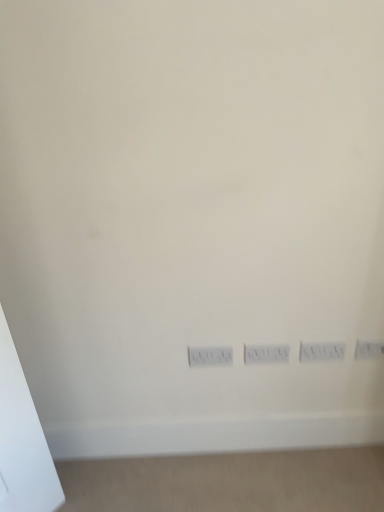
This screenshot has height=512, width=384. What do you see at coordinates (369, 349) in the screenshot? I see `white plastic electric outlet at lower right, positioned as the first electric outlet in right-to-left order` at bounding box center [369, 349].

Find the location of a particular element. Image resolution: width=384 pixels, height=512 pixels. white plastic power plugs and sockets at center is located at coordinates (210, 356).

Image resolution: width=384 pixels, height=512 pixels. Find the location of `white plastic electric outlet at center, the 2th electric outlet from the right`. white plastic electric outlet at center, the 2th electric outlet from the right is located at coordinates (321, 351).

This screenshot has width=384, height=512. What do you see at coordinates (321, 351) in the screenshot?
I see `white plastic electric outlet at center, the first electric outlet viewed from the left` at bounding box center [321, 351].

The width and height of the screenshot is (384, 512). I want to click on white plastic switch at center, so click(266, 354).

Between white plastic power plugs and sockets at center and white plastic electric outlet at center, the first electric outlet viewed from the left, which one appears on the right side from the viewer's perspective?

From the viewer's perspective, white plastic electric outlet at center, the first electric outlet viewed from the left, appears more on the right side.

Which of these two, white plastic power plugs and sockets at center or white plastic electric outlet at center, the first electric outlet viewed from the left, stands taller?

white plastic electric outlet at center, the first electric outlet viewed from the left, is taller.

Is white plastic power plugs and sockets at center positioned with its back to white plastic electric outlet at center, the first electric outlet viewed from the left?

white plastic power plugs and sockets at center is not turned away from white plastic electric outlet at center, the first electric outlet viewed from the left.

Is white plastic power plugs and sockets at center closer to the viewer compared to white plastic electric outlet at center, the 2th electric outlet from the right?

No, white plastic power plugs and sockets at center is further to the viewer.

Where is `electric outlet above the white plastic electric outlet at center, the first electric outlet viewed from the left (from the image's perspective)`? electric outlet above the white plastic electric outlet at center, the first electric outlet viewed from the left (from the image's perspective) is located at coordinates pos(369,349).

Is white plastic electric outlet at lower right, marked as the 2th electric outlet in a left-to-right arrangement, wider than white plastic electric outlet at center, the first electric outlet viewed from the left?

No.

Can white plastic electric outlet at center, the first electric outlet viewed from the left, be found inside white plastic electric outlet at lower right, marked as the 2th electric outlet in a left-to-right arrangement?

No, white plastic electric outlet at lower right, marked as the 2th electric outlet in a left-to-right arrangement, does not contain white plastic electric outlet at center, the first electric outlet viewed from the left.

Is white plastic electric outlet at lower right, marked as the 2th electric outlet in a left-to-right arrangement, positioned with its back to white plastic electric outlet at center, the 2th electric outlet from the right?

white plastic electric outlet at lower right, marked as the 2th electric outlet in a left-to-right arrangement, is not turned away from white plastic electric outlet at center, the 2th electric outlet from the right.

From the image's perspective, who appears lower, white plastic electric outlet at lower right, marked as the 2th electric outlet in a left-to-right arrangement, or white plastic switch at center?

white plastic switch at center.

Considering the sizes of white plastic electric outlet at lower right, marked as the 2th electric outlet in a left-to-right arrangement, and white plastic switch at center in the image, is white plastic electric outlet at lower right, marked as the 2th electric outlet in a left-to-right arrangement, bigger or smaller than white plastic switch at center?

white plastic electric outlet at lower right, marked as the 2th electric outlet in a left-to-right arrangement, is smaller than white plastic switch at center.

Is white plastic electric outlet at lower right, positioned as the first electric outlet in right-to-left order, taller or shorter than white plastic switch at center?

Clearly, white plastic electric outlet at lower right, positioned as the first electric outlet in right-to-left order, is shorter compared to white plastic switch at center.

Looking at this image, could you tell me if white plastic electric outlet at lower right, marked as the 2th electric outlet in a left-to-right arrangement, is turned towards white plastic switch at center?

No.

Is point (331, 354) less distant than point (383, 352)?

Yes, it is.

From a real-world perspective, which is physically above, white plastic electric outlet at center, the 2th electric outlet from the right, or white plastic electric outlet at lower right, marked as the 2th electric outlet in a left-to-right arrangement?

white plastic electric outlet at lower right, marked as the 2th electric outlet in a left-to-right arrangement, from a real-world perspective.

Does white plastic electric outlet at center, the first electric outlet viewed from the left, appear on the right side of white plastic electric outlet at lower right, marked as the 2th electric outlet in a left-to-right arrangement?

In fact, white plastic electric outlet at center, the first electric outlet viewed from the left, is to the left of white plastic electric outlet at lower right, marked as the 2th electric outlet in a left-to-right arrangement.

How different are the orientations of white plastic electric outlet at center, the first electric outlet viewed from the left, and white plastic electric outlet at lower right, marked as the 2th electric outlet in a left-to-right arrangement, in degrees?

0 degrees separate the facing orientations of white plastic electric outlet at center, the first electric outlet viewed from the left, and white plastic electric outlet at lower right, marked as the 2th electric outlet in a left-to-right arrangement.

Is white plastic electric outlet at lower right, marked as the 2th electric outlet in a left-to-right arrangement, spatially inside white plastic power plugs and sockets at center, or outside of it?

white plastic electric outlet at lower right, marked as the 2th electric outlet in a left-to-right arrangement, is located beyond the bounds of white plastic power plugs and sockets at center.

Is white plastic electric outlet at lower right, positioned as the first electric outlet in right-to-left order, wider or thinner than white plastic power plugs and sockets at center?

Clearly, white plastic electric outlet at lower right, positioned as the first electric outlet in right-to-left order, has more width compared to white plastic power plugs and sockets at center.

How many degrees apart are the facing directions of white plastic electric outlet at lower right, positioned as the first electric outlet in right-to-left order, and white plastic power plugs and sockets at center?

The angle between the facing direction of white plastic electric outlet at lower right, positioned as the first electric outlet in right-to-left order, and the facing direction of white plastic power plugs and sockets at center is 0.0477 degrees.

Does point (382, 348) lie behind point (209, 364)?

That is False.

Would you say white plastic switch at center is part of white plastic electric outlet at center, the 2th electric outlet from the right,'s contents?

No, white plastic switch at center is not surrounded by white plastic electric outlet at center, the 2th electric outlet from the right.

From a real-world perspective, is white plastic electric outlet at center, the first electric outlet viewed from the left, positioned above or below white plastic switch at center?

From a real-world perspective, white plastic electric outlet at center, the first electric outlet viewed from the left, is physically above white plastic switch at center.

Considering the sizes of objects white plastic electric outlet at center, the first electric outlet viewed from the left, and white plastic switch at center in the image provided, who is taller, white plastic electric outlet at center, the first electric outlet viewed from the left, or white plastic switch at center?

white plastic switch at center is taller.

Between white plastic electric outlet at center, the 2th electric outlet from the right, and white plastic switch at center, which one appears on the right side from the viewer's perspective?

Positioned to the right is white plastic electric outlet at center, the 2th electric outlet from the right.

From a real-world perspective, is white plastic switch at center beneath white plastic electric outlet at center, the first electric outlet viewed from the left?

Yes, from a real-world perspective, white plastic switch at center is beneath white plastic electric outlet at center, the first electric outlet viewed from the left.

Is white plastic switch at center oriented away from white plastic electric outlet at center, the 2th electric outlet from the right?

No, white plastic electric outlet at center, the 2th electric outlet from the right, is not at the back of white plastic switch at center.

Which electric outlet is the 1st one when counting from the right side of the white plastic switch at center? Please provide its 2D coordinates.

[(321, 351)]

Locate an element on the screen. The height and width of the screenshot is (512, 384). power plugs and sockets on the left side of white plastic electric outlet at center, the 2th electric outlet from the right is located at coordinates (210, 356).

This screenshot has height=512, width=384. What are the coordinates of `electric outlet located in front of the white plastic electric outlet at lower right, positioned as the first electric outlet in right-to-left order` in the screenshot? It's located at (321, 351).

When comparing their distances from white plastic power plugs and sockets at center, does white plastic switch at center or white plastic electric outlet at center, the first electric outlet viewed from the left, seem closer?

Among the two, white plastic switch at center is located nearer to white plastic power plugs and sockets at center.

Based on their spatial positions, is white plastic switch at center or white plastic power plugs and sockets at center closer to white plastic electric outlet at lower right, positioned as the first electric outlet in right-to-left order?

white plastic switch at center.

Which object lies nearer to the anchor point white plastic switch at center, white plastic electric outlet at center, the 2th electric outlet from the right, or white plastic electric outlet at lower right, positioned as the first electric outlet in right-to-left order?

white plastic electric outlet at center, the 2th electric outlet from the right, is closer to white plastic switch at center.

Looking at this image, estimate the real-world distances between objects in this image. Which object is closer to white plastic electric outlet at lower right, marked as the 2th electric outlet in a left-to-right arrangement, white plastic power plugs and sockets at center or white plastic switch at center?

Among the two, white plastic switch at center is located nearer to white plastic electric outlet at lower right, marked as the 2th electric outlet in a left-to-right arrangement.

Which object lies further to the anchor point white plastic electric outlet at lower right, positioned as the first electric outlet in right-to-left order, white plastic switch at center or white plastic electric outlet at center, the first electric outlet viewed from the left?

The object further to white plastic electric outlet at lower right, positioned as the first electric outlet in right-to-left order, is white plastic switch at center.

From the image, which object appears to be nearer to white plastic electric outlet at center, the first electric outlet viewed from the left, white plastic electric outlet at lower right, positioned as the first electric outlet in right-to-left order, or white plastic power plugs and sockets at center?

Among the two, white plastic electric outlet at lower right, positioned as the first electric outlet in right-to-left order, is located nearer to white plastic electric outlet at center, the first electric outlet viewed from the left.

When comparing their distances from white plastic switch at center, does white plastic power plugs and sockets at center or white plastic electric outlet at center, the first electric outlet viewed from the left, seem closer?

white plastic electric outlet at center, the first electric outlet viewed from the left.

From the image, which object appears to be farther from white plastic electric outlet at center, the first electric outlet viewed from the left, white plastic switch at center or white plastic electric outlet at lower right, positioned as the first electric outlet in right-to-left order?

white plastic switch at center is further to white plastic electric outlet at center, the first electric outlet viewed from the left.

Image resolution: width=384 pixels, height=512 pixels. What are the coordinates of `switch between white plastic power plugs and sockets at center and white plastic electric outlet at lower right, marked as the 2th electric outlet in a left-to-right arrangement, in the horizontal direction` in the screenshot? It's located at (266, 354).

The width and height of the screenshot is (384, 512). I want to click on switch between white plastic power plugs and sockets at center and white plastic electric outlet at center, the first electric outlet viewed from the left, in the horizontal direction, so click(x=266, y=354).

At what (x,y) coordinates should I click in order to perform the action: click on electric outlet situated between white plastic switch at center and white plastic electric outlet at lower right, marked as the 2th electric outlet in a left-to-right arrangement, from left to right. Please return your answer as a coordinate pair (x, y). Image resolution: width=384 pixels, height=512 pixels. Looking at the image, I should click on (321, 351).

I want to click on electric outlet between white plastic power plugs and sockets at center and white plastic electric outlet at lower right, positioned as the first electric outlet in right-to-left order, so click(x=321, y=351).